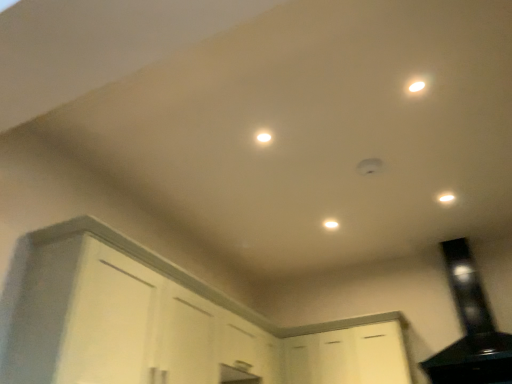
Question: In the image, is white glossy light at upper right, which is counted as the 1th light, starting from the bottom, on the left side or the right side of white matte cabinet at lower left, marked as the second cabinetry in a right-to-left arrangement?

Choices:
 (A) right
 (B) left

Answer: (A)

Question: In terms of width, does white glossy light at upper right, which is the first light in right-to-left order, look wider or thinner when compared to white matte cabinet at lower left, marked as the 1th cabinetry in a left-to-right arrangement?

Choices:
 (A) thin
 (B) wide

Answer: (A)

Question: Estimate the real-world distances between objects in this image. Which object is closer to the white glossy light at center, the first light positioned from the left?

Choices:
 (A) white glossy light at upper right, the 2th light from the right
 (B) white glossy light at upper right, which is counted as the 1th light, starting from the bottom
 (C) white matte light fixture at center
 (D) white matte cabinet at lower center, the 2th cabinetry in the left-to-right sequence
 (E) white matte cabinet at lower left, marked as the second cabinetry in a right-to-left arrangement

Answer: (A)

Question: Which object is positioned farthest from the white matte cabinet at lower left, marked as the second cabinetry in a right-to-left arrangement?

Choices:
 (A) black glossy exhaust hood at upper right
 (B) white glossy light at center, the 2th light in the back-to-front sequence
 (C) white glossy light at upper right, placed as the 3th light when sorted from top to bottom
 (D) white matte light fixture at center
 (E) white glossy light at upper right, which ranks as the second light in left-to-right order

Answer: (E)